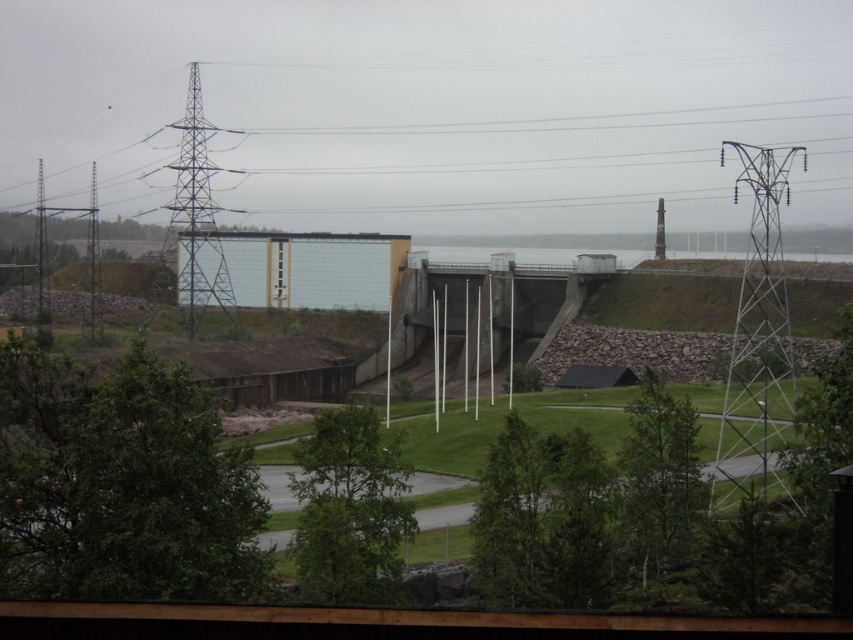
You are a photographer standing at the base of the dam. You want to capture both the metallic silver tower at right and the metallic grid tower at left in your photo. Which tower will appear closer to the bottom edge of your camera frame?

The metallic silver tower at right will appear closer to the bottom edge of your camera frame because it is located below the metallic grid tower at left.

Looking at this image, you are an engineer assessing the stability of the towers in the image. Given that the metallic grid tower at left is wider than the smooth concrete tower at upper right, which tower might have a higher load capacity based on their widths alone?

The metallic grid tower at left has a larger width than the smooth concrete tower at upper right, so it likely has a higher load capacity due to its wider base providing better stability.

You are standing at the center of the grassy area in front of the dam. Which direction should you walk to reach the metallic silver tower at right?

The metallic silver tower at right is located at point (x=757, y=342), so you should walk towards the right side of the dam to reach it.